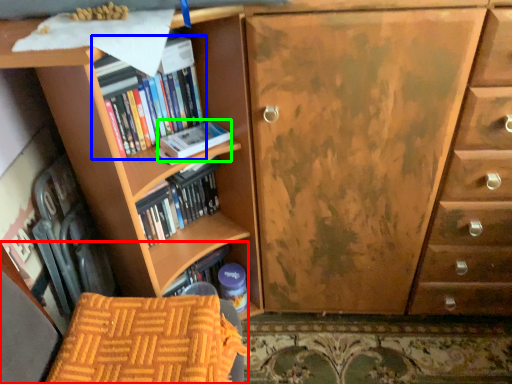
Question: Which is farther away from armchair (highlighted by a red box)? book (highlighted by a blue box) or paperback book (highlighted by a green box)?

Choices:
 (A) book
 (B) paperback book

Answer: (A)